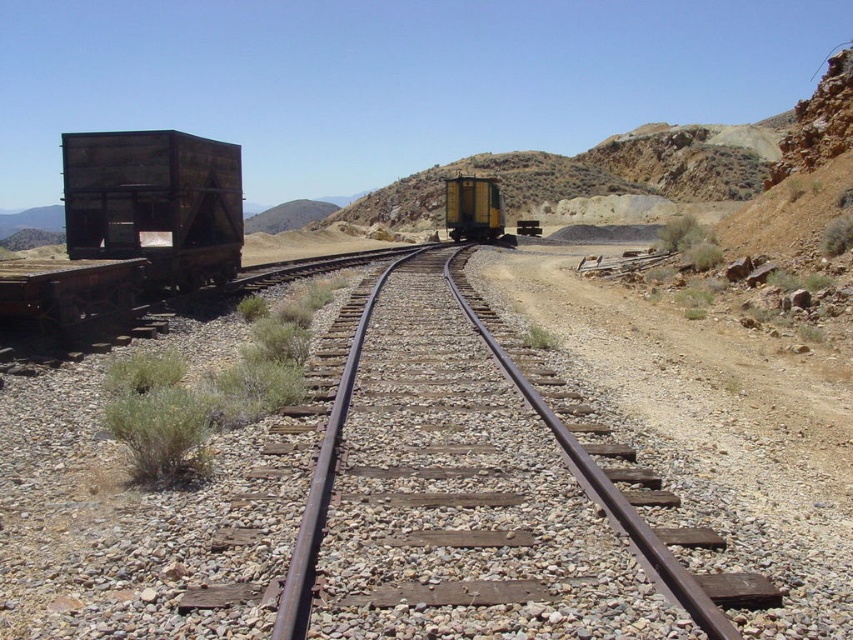
You are a maintenance worker inspecting the railway tracks. You notice the rusty metal track at center and the yellow matte train car at center. Which object is positioned lower in the image?

The rusty metal track at center is located below the yellow matte train car at center, so it is positioned lower in the image.

You are standing at the point closer to the viewer in the image. Which point are you at, point (45,330) or point (457,180)?

You are at point (45,330) because it is closer to the viewer than point (457,180).